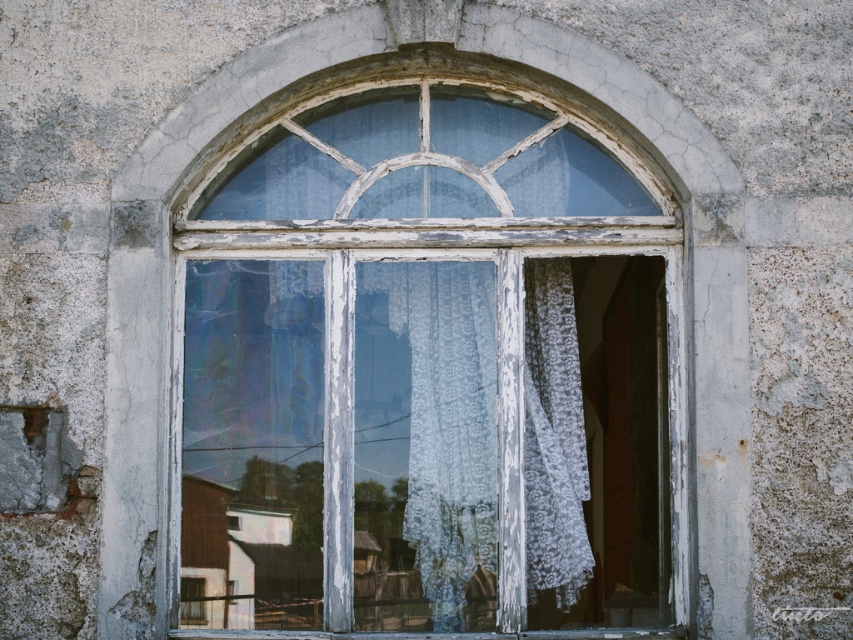
Does white peeling paint at center appear under white lace curtain at center?

No, white peeling paint at center is not below white lace curtain at center.

Between point (491, 392) and point (467, 355), which one is positioned in front?

Point (491, 392) is more forward.

You are a GUI agent. You are given a task and a screenshot of the screen. Output one action in this format:
    pyautogui.click(x=<x>, y=<y>)
    Task: Click on the white peeling paint at center
    
    Given the screenshot: What is the action you would take?
    pyautogui.click(x=431, y=365)